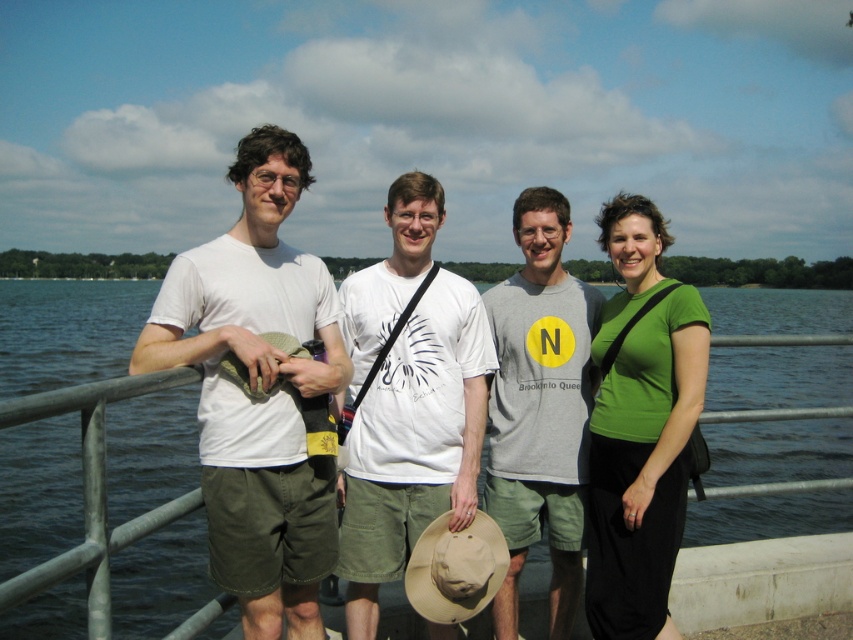
Question: Considering the real-world distances, which object is farthest from the white cotton t-shirt at left?

Choices:
 (A) gray cotton t-shirt at center
 (B) green matte shirt at center
 (C) blue water at center

Answer: (C)

Question: Does white cotton t-shirt at left have a greater width compared to green matte shirt at center?

Choices:
 (A) yes
 (B) no

Answer: (A)

Question: Which point is farther to the camera?

Choices:
 (A) gray cotton t-shirt at center
 (B) green matte shirt at center
 (C) white cotton t-shirt at left
 (D) blue water at center

Answer: (A)

Question: Which is farther from the blue water at center?

Choices:
 (A) white cotton t-shirt at left
 (B) green matte shirt at center
 (C) white matte t-shirt at center
 (D) gray cotton t-shirt at center

Answer: (C)

Question: Is white matte t-shirt at center to the left of gray cotton t-shirt at center from the viewer's perspective?

Choices:
 (A) yes
 (B) no

Answer: (A)

Question: Where is blue water at center located in relation to white cotton t-shirt at left in the image?

Choices:
 (A) above
 (B) below

Answer: (A)